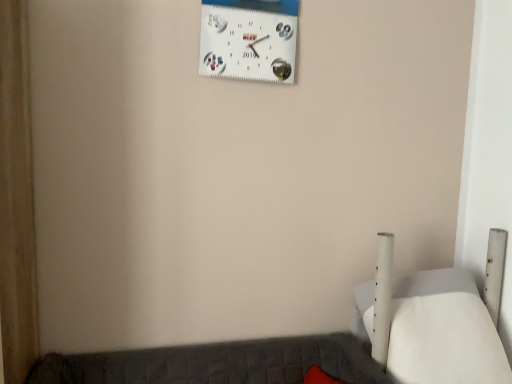
Question: Is white matte bed at lower right at the back of white matte wall clock at upper center?

Choices:
 (A) yes
 (B) no

Answer: (B)

Question: From a real-world perspective, is white matte wall clock at upper center located higher than white matte bed at lower right?

Choices:
 (A) no
 (B) yes

Answer: (B)

Question: Does white matte wall clock at upper center lie behind white matte bed at lower right?

Choices:
 (A) yes
 (B) no

Answer: (A)

Question: Does white matte wall clock at upper center appear on the right side of white matte bed at lower right?

Choices:
 (A) no
 (B) yes

Answer: (A)

Question: Is white matte wall clock at upper center aimed at white matte bed at lower right?

Choices:
 (A) no
 (B) yes

Answer: (A)

Question: Can you confirm if white matte wall clock at upper center is taller than white matte bed at lower right?

Choices:
 (A) yes
 (B) no

Answer: (B)

Question: From a real-world perspective, does white matte bed at lower right sit lower than white matte wall clock at upper center?

Choices:
 (A) yes
 (B) no

Answer: (A)

Question: Is white matte bed at lower right shorter than white matte wall clock at upper center?

Choices:
 (A) yes
 (B) no

Answer: (B)

Question: Considering the relative positions of white matte bed at lower right and white matte wall clock at upper center in the image provided, is white matte bed at lower right to the right of white matte wall clock at upper center from the viewer's perspective?

Choices:
 (A) yes
 (B) no

Answer: (A)

Question: Does white matte bed at lower right have a larger size compared to white matte wall clock at upper center?

Choices:
 (A) no
 (B) yes

Answer: (B)

Question: From the image's perspective, is white matte bed at lower right on top of white matte wall clock at upper center?

Choices:
 (A) no
 (B) yes

Answer: (A)

Question: Is white matte bed at lower right closer to camera compared to white matte wall clock at upper center?

Choices:
 (A) no
 (B) yes

Answer: (B)

Question: Relative to white matte wall clock at upper center, is white matte bed at lower right in front or behind?

Choices:
 (A) front
 (B) behind

Answer: (A)